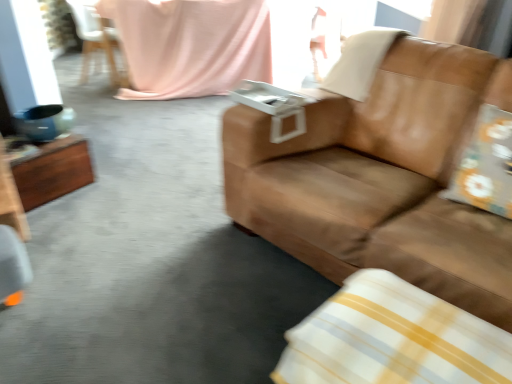
The height and width of the screenshot is (384, 512). Describe the element at coordinates (96, 39) in the screenshot. I see `white plastic chair at upper left` at that location.

Describe the element at coordinates (382, 178) in the screenshot. Image resolution: width=512 pixels, height=384 pixels. I see `brown leather couch at center` at that location.

Where is `brown leather couch at center`? This screenshot has height=384, width=512. brown leather couch at center is located at coordinates (382, 178).

Locate an element on the screen. beige leather pillow at upper right, placed as the third pillow when sorted from bottom to top is located at coordinates (360, 62).

Identify the location of floral fabric pillow at right, which is counted as the second pillow, starting from the top. The image size is (512, 384). click(x=486, y=165).

The image size is (512, 384). What do you see at coordinates (486, 165) in the screenshot?
I see `floral fabric pillow at right, which is counted as the second pillow, starting from the top` at bounding box center [486, 165].

Locate an element on the screen. Image resolution: width=512 pixels, height=384 pixels. wooden table at left is located at coordinates (53, 171).

Is brown leather couch at center shorter than white/yellow striped pillow at lower right, which is counted as the third pillow, starting from the back?

In fact, brown leather couch at center may be taller than white/yellow striped pillow at lower right, which is counted as the third pillow, starting from the back.

Can you confirm if brown leather couch at center is bigger than white/yellow striped pillow at lower right, the first pillow viewed from the front?

Correct, brown leather couch at center is larger in size than white/yellow striped pillow at lower right, the first pillow viewed from the front.

Is brown leather couch at center thinner than white/yellow striped pillow at lower right, which is counted as the third pillow, starting from the back?

No, brown leather couch at center is not thinner than white/yellow striped pillow at lower right, which is counted as the third pillow, starting from the back.

How far apart are pink fabric at upper center and beige leather pillow at upper right, the 1th pillow when ordered from top to bottom?

pink fabric at upper center is 5.78 feet from beige leather pillow at upper right, the 1th pillow when ordered from top to bottom.

Does pink fabric at upper center turn towards beige leather pillow at upper right, the first pillow positioned from the back?

Yes, pink fabric at upper center is aimed at beige leather pillow at upper right, the first pillow positioned from the back.

What's the angular difference between pink fabric at upper center and beige leather pillow at upper right, the first pillow positioned from the back,'s facing directions?

The angular difference between pink fabric at upper center and beige leather pillow at upper right, the first pillow positioned from the back, is 52.2 degrees.

Which object is further away from the camera taking this photo, pink fabric at upper center or beige leather pillow at upper right, the 1th pillow when ordered from top to bottom?

pink fabric at upper center is more distant.

Which point is more forward, (311, 249) or (362, 69)?

The point (311, 249) is in front.

Is brown leather couch at center positioned far away from beige leather pillow at upper right, the first pillow positioned from the back?

brown leather couch at center is near beige leather pillow at upper right, the first pillow positioned from the back, not far away.

The width and height of the screenshot is (512, 384). In order to click on studio couch directly beneath the beige leather pillow at upper right, the 1th pillow when ordered from top to bottom (from a real-world perspective) in this screenshot , I will do `click(382, 178)`.

Is brown leather couch at center bigger than beige leather pillow at upper right, the first pillow positioned from the back?

Yes.

Does wooden table at left appear on the right side of white plastic chair at upper left?

Indeed, wooden table at left is positioned on the right side of white plastic chair at upper left.

Locate an element on the screen. table below the white plastic chair at upper left (from the image's perspective) is located at coordinates [53, 171].

Is wooden table at left positioned beyond the bounds of white plastic chair at upper left?

That's correct, wooden table at left is outside of white plastic chair at upper left.

Can you confirm if wooden table at left is smaller than white plastic chair at upper left?

Correct, wooden table at left occupies less space than white plastic chair at upper left.

Is pink fabric at upper center with wooden table at left?

No.

Could you tell me if pink fabric at upper center is turned towards wooden table at left?

Yes, pink fabric at upper center is aimed at wooden table at left.

From the image's perspective, between pink fabric at upper center and wooden table at left, which one is located above?

pink fabric at upper center, from the image's perspective.

Is pink fabric at upper center to the left or to the right of wooden table at left in the image?

Based on their positions, pink fabric at upper center is located to the right of wooden table at left.

Can you tell me how much white plastic chair at upper left and beige leather pillow at upper right, which is the 3th pillow from front to back, differ in facing direction?

The facing directions of white plastic chair at upper left and beige leather pillow at upper right, which is the 3th pillow from front to back, are 141 degrees apart.

From a real-world perspective, is white plastic chair at upper left on beige leather pillow at upper right, which is the 3th pillow from front to back?

Incorrect, from a real-world perspective, white plastic chair at upper left is lower than beige leather pillow at upper right, which is the 3th pillow from front to back.

Is there a large distance between white plastic chair at upper left and beige leather pillow at upper right, the first pillow positioned from the back?

That's right, there is a large distance between white plastic chair at upper left and beige leather pillow at upper right, the first pillow positioned from the back.

Which is more to the right, white plastic chair at upper left or beige leather pillow at upper right, placed as the third pillow when sorted from bottom to top?

Positioned to the right is beige leather pillow at upper right, placed as the third pillow when sorted from bottom to top.

Does brown leather couch at center come in front of wooden table at left?

Yes.

Considering the relative sizes of brown leather couch at center and wooden table at left in the image provided, is brown leather couch at center shorter than wooden table at left?

In fact, brown leather couch at center may be taller than wooden table at left.

Measure the distance between brown leather couch at center and wooden table at left.

A distance of 1.34 meters exists between brown leather couch at center and wooden table at left.

Which object is wider, brown leather couch at center or wooden table at left?

With larger width is brown leather couch at center.

In order to click on studio couch above the white/yellow striped pillow at lower right, the 1th pillow positioned from the bottom (from a real-world perspective) in this screenshot , I will do `click(382, 178)`.

Locate an element on the screen. This screenshot has height=384, width=512. blanket on the left side of beige leather pillow at upper right, the first pillow positioned from the back is located at coordinates (190, 45).

Looking at the image, which one is located further to wooden table at left, white plastic chair at upper left or beige leather pillow at upper right, the 1th pillow when ordered from top to bottom?

Among the two, white plastic chair at upper left is located further to wooden table at left.

Which object lies nearer to the anchor point floral fabric pillow at right, which ranks as the second pillow in bottom-to-top order, beige leather pillow at upper right, placed as the third pillow when sorted from bottom to top, or wooden table at left?

The object closer to floral fabric pillow at right, which ranks as the second pillow in bottom-to-top order, is beige leather pillow at upper right, placed as the third pillow when sorted from bottom to top.

Based on their spatial positions, is pink fabric at upper center or beige leather pillow at upper right, which is the 3th pillow from front to back, closer to wooden table at left?

beige leather pillow at upper right, which is the 3th pillow from front to back, lies closer to wooden table at left than the other object.

Looking at the image, which one is located closer to beige leather pillow at upper right, the 1th pillow when ordered from top to bottom, white plastic chair at upper left or floral fabric pillow at right, which appears as the 2th pillow when viewed from the back?

floral fabric pillow at right, which appears as the 2th pillow when viewed from the back, is closer to beige leather pillow at upper right, the 1th pillow when ordered from top to bottom.

Based on their spatial positions, is wooden table at left or pink fabric at upper center further from beige leather pillow at upper right, the first pillow positioned from the back?

pink fabric at upper center is further to beige leather pillow at upper right, the first pillow positioned from the back.

Considering their positions, is wooden table at left positioned further to brown leather couch at center than white/yellow striped pillow at lower right, the 1th pillow positioned from the bottom?

The object further to brown leather couch at center is wooden table at left.

From the image, which object appears to be nearer to beige leather pillow at upper right, which is the 3th pillow from front to back, brown leather couch at center or white plastic chair at upper left?

brown leather couch at center lies closer to beige leather pillow at upper right, which is the 3th pillow from front to back, than the other object.

From the image, which object appears to be nearer to white/yellow striped pillow at lower right, which is counted as the third pillow, starting from the back, floral fabric pillow at right, which is counted as the second pillow, starting from the top, or wooden table at left?

Among the two, floral fabric pillow at right, which is counted as the second pillow, starting from the top, is located nearer to white/yellow striped pillow at lower right, which is counted as the third pillow, starting from the back.

Identify the location of studio couch between wooden table at left and floral fabric pillow at right, which ranks as the second pillow in bottom-to-top order, from left to right. Image resolution: width=512 pixels, height=384 pixels. (382, 178).

The height and width of the screenshot is (384, 512). What are the coordinates of `blanket between brown leather couch at center and white plastic chair at upper left from front to back` in the screenshot? It's located at (190, 45).

Identify the location of table between white plastic chair at upper left and floral fabric pillow at right, which ranks as the second pillow in bottom-to-top order, in the horizontal direction. This screenshot has width=512, height=384. (53, 171).

You are a GUI agent. You are given a task and a screenshot of the screen. Output one action in this format:
    pyautogui.click(x=<x>, y=<y>)
    Task: Click on the pillow between floral fabric pillow at right, which ranks as the second pillow in bottom-to-top order, and pink fabric at upper center in the front-back direction
    This screenshot has width=512, height=384.
    Given the screenshot: What is the action you would take?
    pyautogui.click(x=360, y=62)